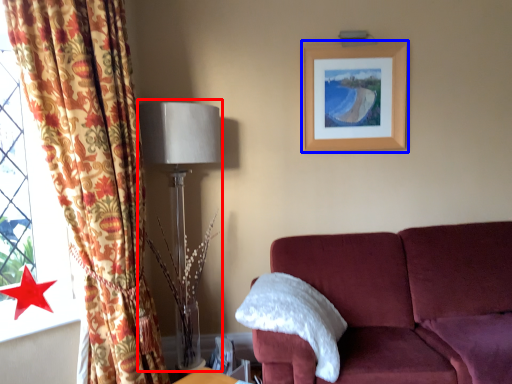
Question: Which of the following is the farthest to the observer, table lamp (highlighted by a red box) or picture frame (highlighted by a blue box)?

Choices:
 (A) table lamp
 (B) picture frame

Answer: (B)